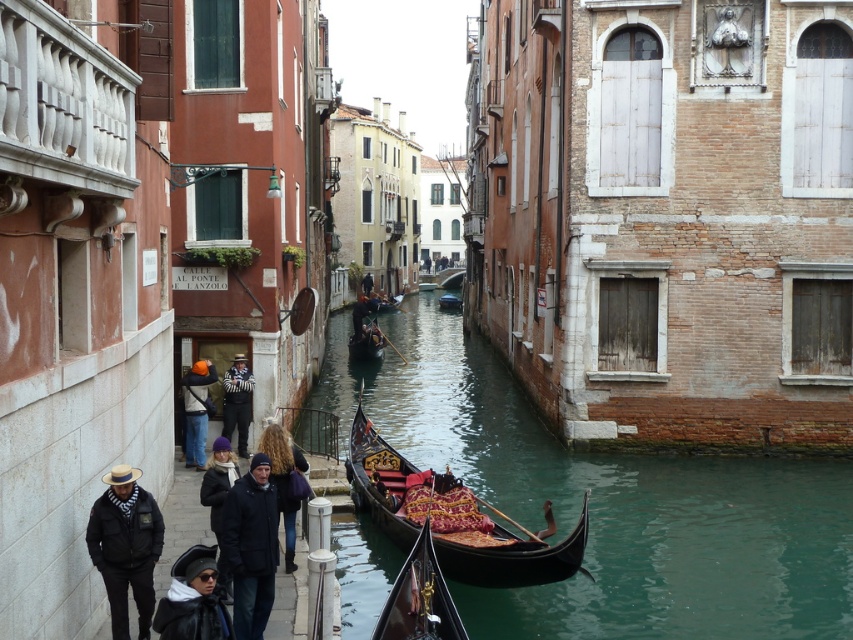
Is black matte jacket at lower left positioned before dark brown leather jacket at center?

Yes, black matte jacket at lower left is closer to the viewer.

Does black matte jacket at lower left have a smaller size compared to dark brown leather jacket at center?

No, black matte jacket at lower left is not smaller than dark brown leather jacket at center.

Locate an element on the screen. black matte jacket at lower left is located at coordinates (125, 547).

Which is behind, point (160, 598) or point (189, 371)?

The point (189, 371) is behind.

Based on the photo, between black leather coat at lower left and orange helmet at center, which one has more height?

orange helmet at center

Is point (225, 611) farther from camera compared to point (196, 372)?

No, (225, 611) is closer to viewer.

Locate an element on the screen. This screenshot has width=853, height=640. black leather coat at lower left is located at coordinates (193, 600).

Does smooth dark wood gondola at center have a greater width compared to wooden gondola at center?

Yes.

How much distance is there between smooth dark wood gondola at center and wooden gondola at center?

Result: The distance of smooth dark wood gondola at center from wooden gondola at center is 71.84 meters.

Where is `smooth dark wood gondola at center`? This screenshot has width=853, height=640. smooth dark wood gondola at center is located at coordinates (607, 502).